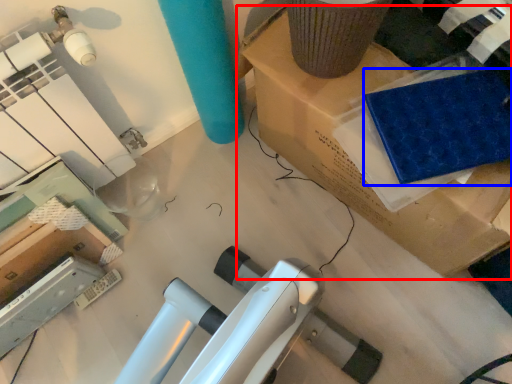
Question: Which object appears farthest to the camera in this image, furniture (highlighted by a red box) or fabric (highlighted by a blue box)?

Choices:
 (A) furniture
 (B) fabric

Answer: (B)